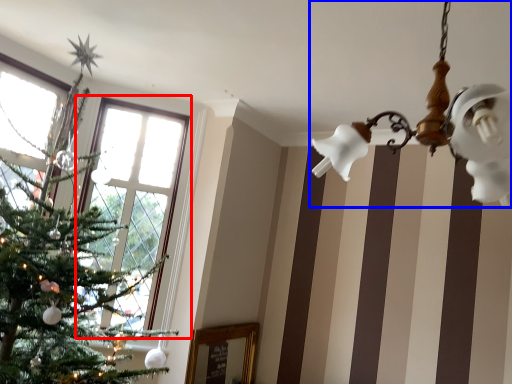
Question: Among these objects, which one is farthest to the camera, window (highlighted by a red box) or light fixture (highlighted by a blue box)?

Choices:
 (A) window
 (B) light fixture

Answer: (A)